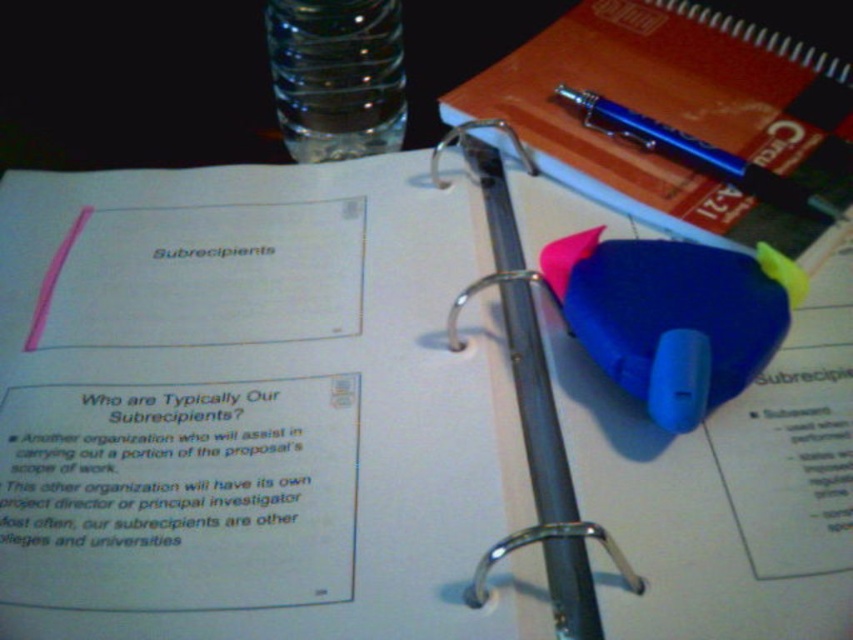
Question: Which object is the closest to the blue rubber eraser at center?

Choices:
 (A) white paper at center
 (B) blue plastic pen at center

Answer: (B)

Question: Which is nearer to the orange matte notepad at upper right?

Choices:
 (A) white paper at center
 (B) transparent glass bottle at upper center

Answer: (B)

Question: Does blue rubber eraser at center have a lesser width compared to blue plastic pen at center?

Choices:
 (A) yes
 (B) no

Answer: (B)

Question: Is white paper at center to the left of blue plastic pen at center from the viewer's perspective?

Choices:
 (A) yes
 (B) no

Answer: (A)

Question: Which point is closer to the camera?

Choices:
 (A) (782, 202)
 (B) (459, 92)

Answer: (A)

Question: Is blue plastic pen at center thinner than transparent glass bottle at upper center?

Choices:
 (A) yes
 (B) no

Answer: (A)